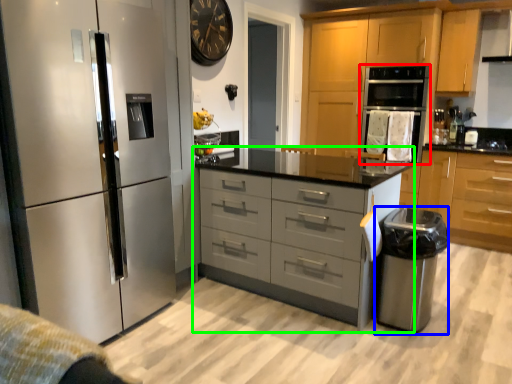
Question: Considering the real-world distances, which object is farthest from oven (highlighted by a red box)? appliance (highlighted by a blue box) or chest of drawers (highlighted by a green box)?

Choices:
 (A) appliance
 (B) chest of drawers

Answer: (B)